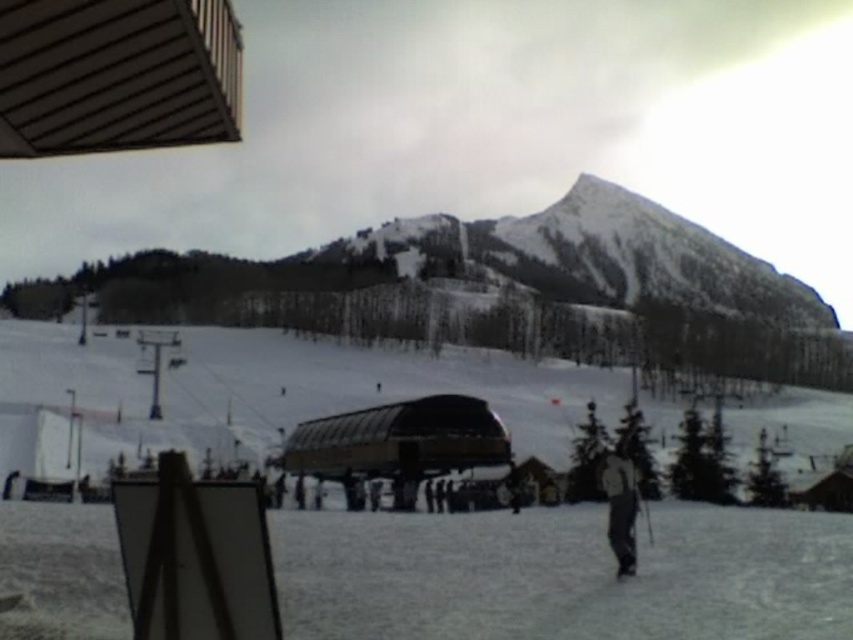
In the scene shown: You are a photographer trying to capture the black matte ski at lower right in the frame. Since the white matte snow at center is taller than the ski, will the ski be visible in the photo if you focus on the snow?

The white matte snow at center is taller than the black matte ski at lower right, so the ski will be visible as it is positioned lower in the frame and the snow is elevated, allowing both to be in the shot.

You are a photographer trying to capture the gray fabric jacket at lower right and the black matte ski at lower right in the same frame. Which object should you zoom in on to ensure both are visible without cropping?

Since the gray fabric jacket at lower right is wider than the black matte ski at lower right, you should zoom in on the gray fabric jacket at lower right to ensure both objects are visible without cropping.

You are a photographer standing at the edge of the snow area. You want to capture a photo of the black matte ski at lower right and the white matte snow at center. Which object should you focus on first if you want both to be in sharp focus?

The white matte snow at center is positioned on the left side of black matte ski at lower right. To have both in focus, you should focus on the black matte ski at lower right since it is closer to the camera, ensuring the snow at center will also be in focus due to depth of field.